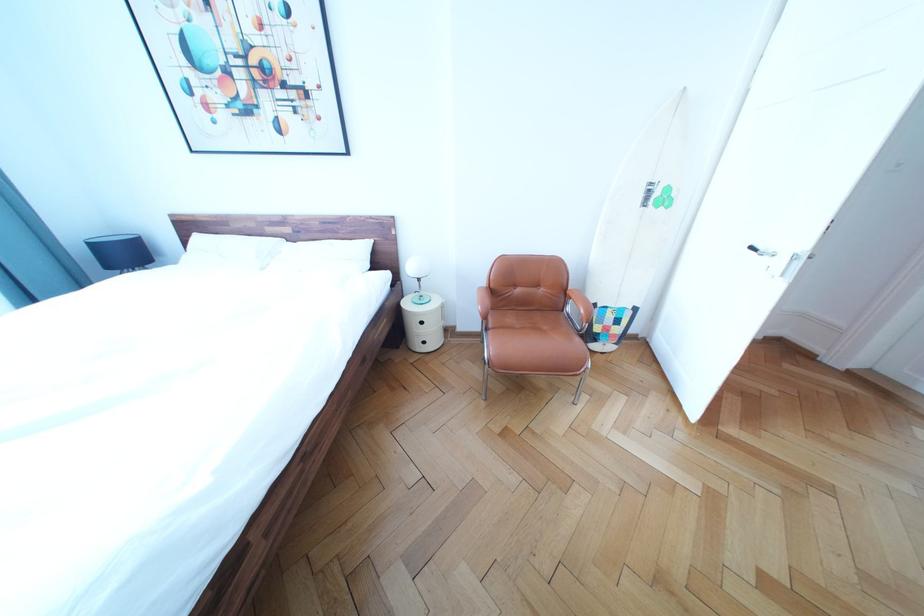
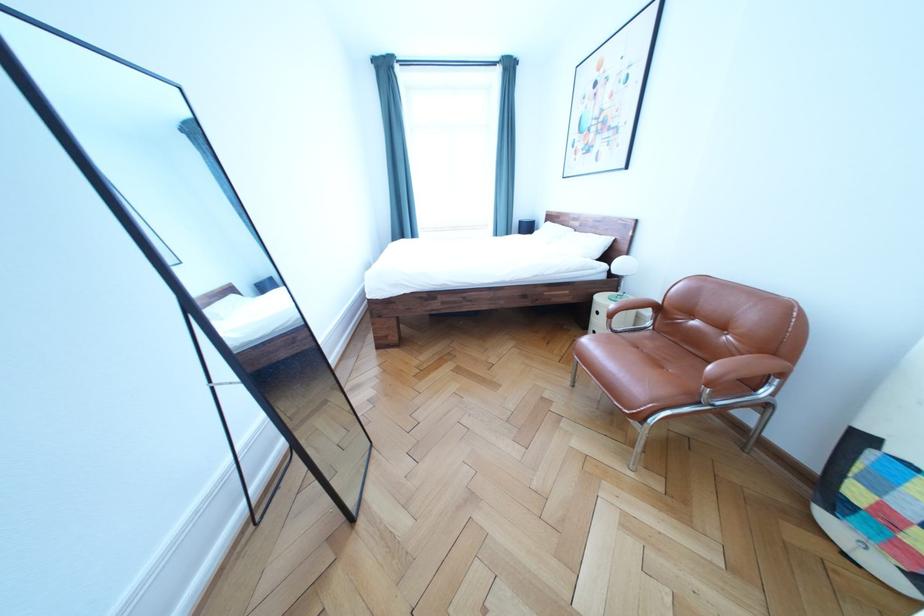
Find the pixel in the second image that matches pixel 298 236 in the first image.

(588, 230)